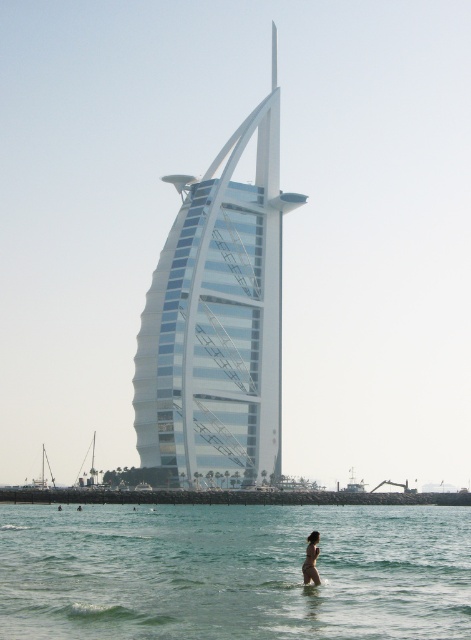
Based on the photo, is clear water at lower center smaller than white glass tower at center?

Indeed, clear water at lower center has a smaller size compared to white glass tower at center.

How distant is clear water at lower center from white glass tower at center?

The distance of clear water at lower center from white glass tower at center is 31.46 meters.

Who is more forward, (469, 636) or (199, 353)?

Positioned in front is point (469, 636).

The width and height of the screenshot is (471, 640). In order to click on clear water at lower center in this screenshot , I will do `click(233, 572)`.

Is clear water at lower center bigger than tan skin human at lower center?

Correct, clear water at lower center is larger in size than tan skin human at lower center.

In the scene shown: Can you confirm if clear water at lower center is smaller than tan skin human at lower center?

No, clear water at lower center is not smaller than tan skin human at lower center.

Is point (118, 541) positioned behind point (310, 573)?

That is True.

Find the location of a particular element. The height and width of the screenshot is (640, 471). clear water at lower center is located at coordinates (x=233, y=572).

Is white glass tower at center taller than tan skin human at lower center?

Correct, white glass tower at center is much taller as tan skin human at lower center.

Describe the element at coordinates (218, 316) in the screenshot. I see `white glass tower at center` at that location.

Which is behind, point (212, 298) or point (306, 580)?

The point (212, 298) is behind.

Where is `white glass tower at center`? white glass tower at center is located at coordinates (218, 316).